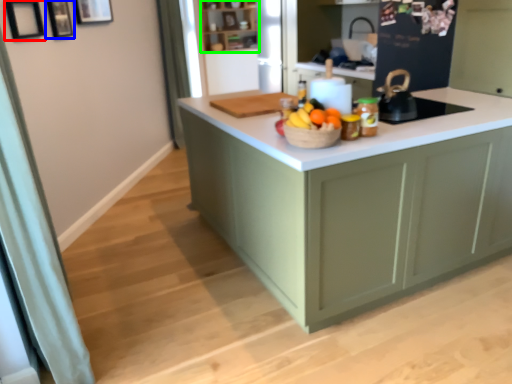
Question: Which is nearer to the picture frame (highlighted by a red box)? picture frame (highlighted by a blue box) or shelf (highlighted by a green box).

Choices:
 (A) picture frame
 (B) shelf

Answer: (A)